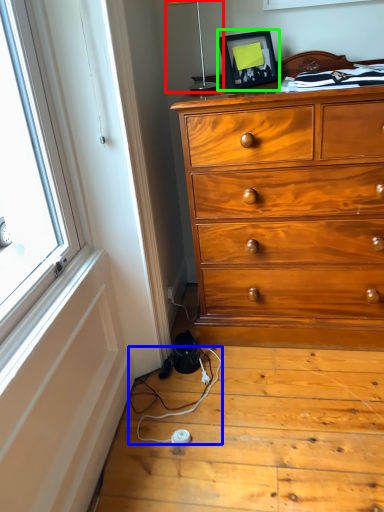
Question: Which object is the farthest from table lamp (highlighted by a red box)? Choose among these: twin (highlighted by a blue box) or picture frame (highlighted by a green box).

Choices:
 (A) twin
 (B) picture frame

Answer: (A)